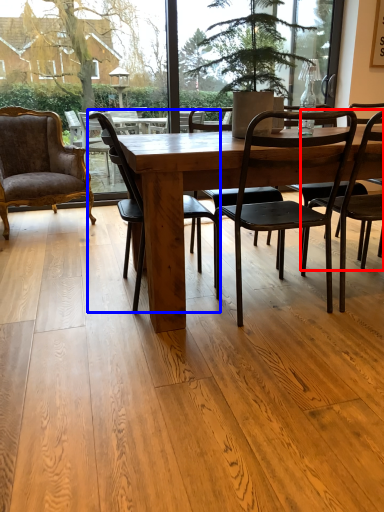
Question: Which object appears closest to the camera in this image, chair (highlighted by a red box) or chair (highlighted by a blue box)?

Choices:
 (A) chair
 (B) chair

Answer: (A)